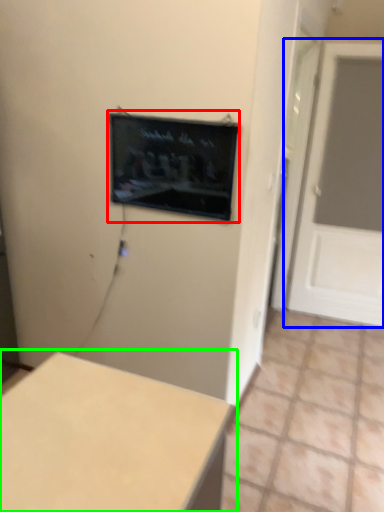
Question: Which is farther away from computer screen (highlighted by a red box)? door (highlighted by a blue box) or table (highlighted by a green box)?

Choices:
 (A) door
 (B) table

Answer: (A)